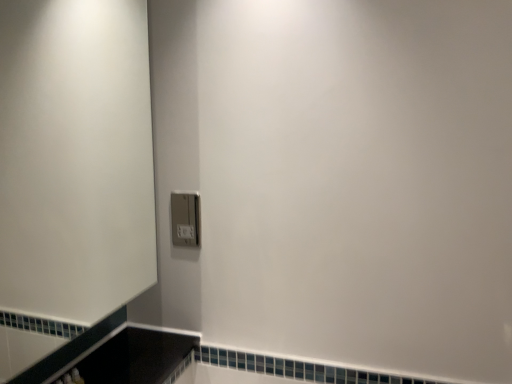
Where is `satin silver switch at lower center`? This screenshot has width=512, height=384. satin silver switch at lower center is located at coordinates (185, 219).

What is the approximate height of satin silver switch at lower center?

The height of satin silver switch at lower center is 5.71 inches.

In order to face satin silver switch at lower center, should I rotate leftwards or rightwards?

You should rotate left by 9.203 degrees.

Describe the element at coordinates (185, 219) in the screenshot. I see `satin silver switch at lower center` at that location.

At what (x,y) coordinates should I click in order to perform the action: click on white matte screen door at upper left. Please return your answer as a coordinate pair (x, y). The image size is (512, 384). Looking at the image, I should click on (75, 157).

The width and height of the screenshot is (512, 384). Describe the element at coordinates (75, 157) in the screenshot. I see `white matte screen door at upper left` at that location.

Find the location of a particular element. satin silver switch at lower center is located at coordinates (185, 219).

Which is more to the left, satin silver switch at lower center or white matte screen door at upper left?

white matte screen door at upper left.

Considering the relative positions of satin silver switch at lower center and white matte screen door at upper left in the image provided, is satin silver switch at lower center behind white matte screen door at upper left?

Yes.

Which is more distant, (177,197) or (94,87)?

The point (177,197) is more distant.

From the image's perspective, which object appears higher, satin silver switch at lower center or white matte screen door at upper left?

From the image's view, white matte screen door at upper left is above.

From a real-world perspective, is satin silver switch at lower center positioned above or below white matte screen door at upper left?

In terms of real-world spatial position, satin silver switch at lower center is below white matte screen door at upper left.

Considering the sizes of satin silver switch at lower center and white matte screen door at upper left in the image, is satin silver switch at lower center wider or thinner than white matte screen door at upper left?

Considering their sizes, satin silver switch at lower center looks slimmer than white matte screen door at upper left.

Which of these two, satin silver switch at lower center or white matte screen door at upper left, stands shorter?

Standing shorter between the two is satin silver switch at lower center.

Can you confirm if satin silver switch at lower center is smaller than white matte screen door at upper left?

Indeed, satin silver switch at lower center has a smaller size compared to white matte screen door at upper left.

Is satin silver switch at lower center located outside white matte screen door at upper left?

That's correct, satin silver switch at lower center is outside of white matte screen door at upper left.

Is satin silver switch at lower center beside white matte screen door at upper left?

satin silver switch at lower center and white matte screen door at upper left are clearly separated.

Consider the image. Is satin silver switch at lower center aimed at white matte screen door at upper left?

Yes, satin silver switch at lower center is facing white matte screen door at upper left.

Locate an element on the screen. The height and width of the screenshot is (384, 512). screen door to the left of satin silver switch at lower center is located at coordinates (75, 157).

Does white matte screen door at upper left appear on the left side of satin silver switch at lower center?

Correct, you'll find white matte screen door at upper left to the left of satin silver switch at lower center.

Is white matte screen door at upper left in front of or behind satin silver switch at lower center in the image?

white matte screen door at upper left is positioned closer to the viewer than satin silver switch at lower center.

Which is farther, (118, 215) or (195, 226)?

The point (118, 215) is farther from the camera.

From the image's perspective, which one is positioned higher, white matte screen door at upper left or satin silver switch at lower center?

white matte screen door at upper left is shown above in the image.

From a real-world perspective, is white matte screen door at upper left on top of satin silver switch at lower center?

Yes.

Does white matte screen door at upper left have a lesser width compared to satin silver switch at lower center?

No, white matte screen door at upper left is not thinner than satin silver switch at lower center.

Is white matte screen door at upper left shorter than satin silver switch at lower center?

No, white matte screen door at upper left is not shorter than satin silver switch at lower center.

Considering the sizes of objects white matte screen door at upper left and satin silver switch at lower center in the image provided, who is bigger, white matte screen door at upper left or satin silver switch at lower center?

white matte screen door at upper left.

Choose the correct answer: Is white matte screen door at upper left inside satin silver switch at lower center or outside it?

white matte screen door at upper left is located beyond the bounds of satin silver switch at lower center.

Are white matte screen door at upper left and satin silver switch at lower center located far from each other?

No, white matte screen door at upper left is not far away from satin silver switch at lower center.

Does white matte screen door at upper left turn towards satin silver switch at lower center?

No, white matte screen door at upper left is not turned towards satin silver switch at lower center.

In order to click on screen door in front of the satin silver switch at lower center in this screenshot , I will do `click(75, 157)`.

Identify the location of light switch lying below the white matte screen door at upper left (from the image's perspective). (185, 219).

This screenshot has width=512, height=384. In order to click on light switch that is behind the white matte screen door at upper left in this screenshot , I will do `click(185, 219)`.